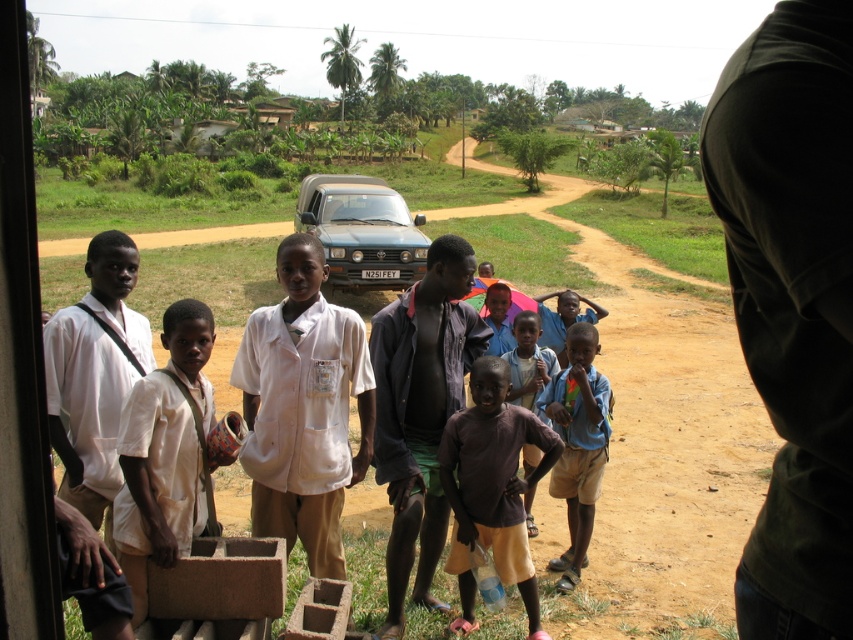
You are a photographer trying to capture both the white matte shirt at center and the blue cotton shirt at center in a single frame. Since the shirts are of different sizes, which one might appear closer to the camera in the photo?

The white matte shirt at center has a larger size compared to blue cotton shirt at center, so it might appear closer to the camera in the photo.

You are a photographer trying to capture a group photo of the children. You notice the white matte shirt at center and the light brown skin at center. Which one appears taller in the photo?

The white matte shirt at center appears taller than the light brown skin at center in the photo.

You are standing at the point with coordinates point (x=519, y=364) and want to walk to the point with coordinates point (x=329, y=545). Which direction should you move relative to your current position?

You should move forward because point (x=329, y=545) is in front of point (x=519, y=364).